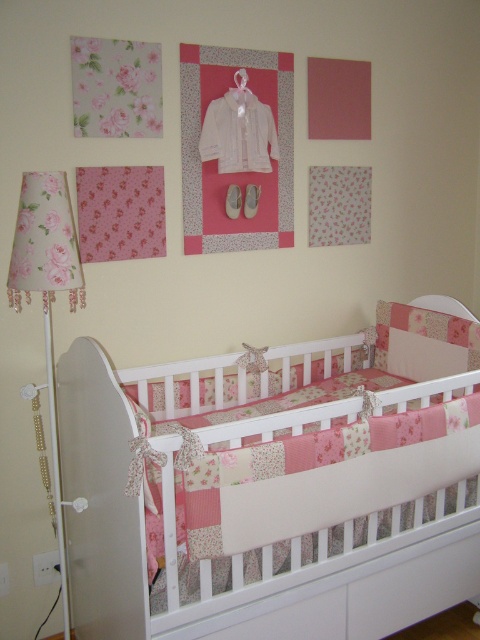
Question: Which point is closer to the camera taking this photo?

Choices:
 (A) (342, 524)
 (B) (74, 308)

Answer: (B)

Question: Does white patchwork crib at lower left appear under floral fabric lampshade at left?

Choices:
 (A) no
 (B) yes

Answer: (B)

Question: In this image, where is white patchwork crib at lower left located relative to floral fabric lampshade at left?

Choices:
 (A) right
 (B) left

Answer: (A)

Question: Which object is farther from the camera taking this photo?

Choices:
 (A) floral fabric lampshade at left
 (B) white patchwork crib at lower left

Answer: (A)

Question: Does white patchwork crib at lower left lie in front of floral fabric lampshade at left?

Choices:
 (A) yes
 (B) no

Answer: (A)